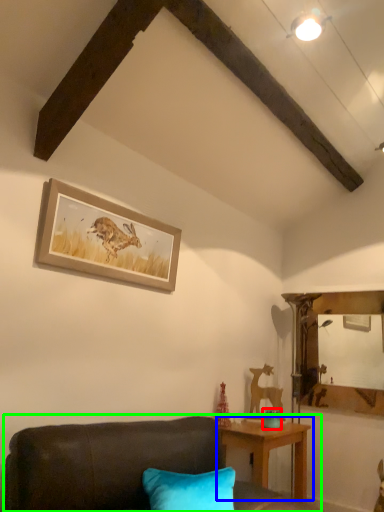
Question: Based on their relative distances, which object is farther from teal (highlighted by a red box)? Choose from table (highlighted by a blue box) and studio couch (highlighted by a green box).

Choices:
 (A) table
 (B) studio couch

Answer: (B)